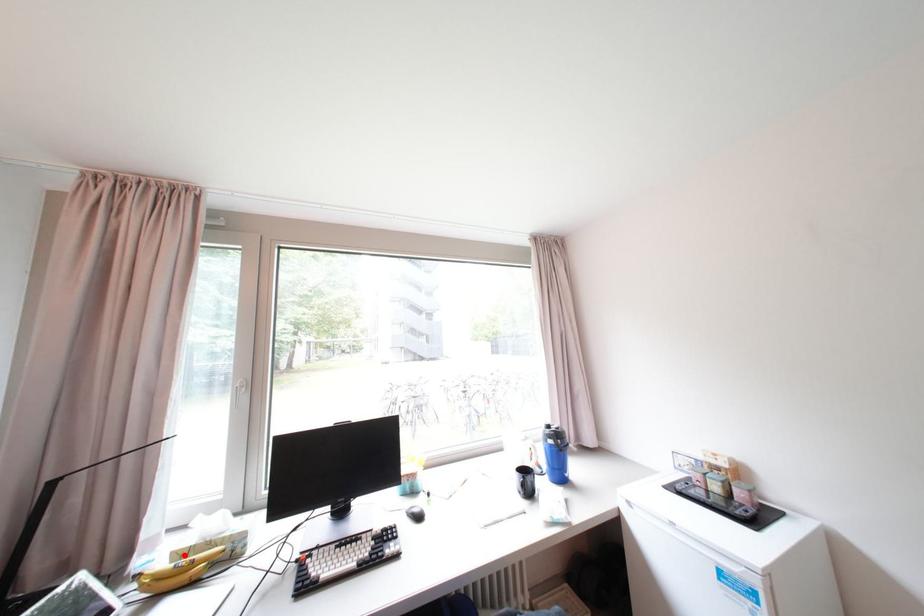
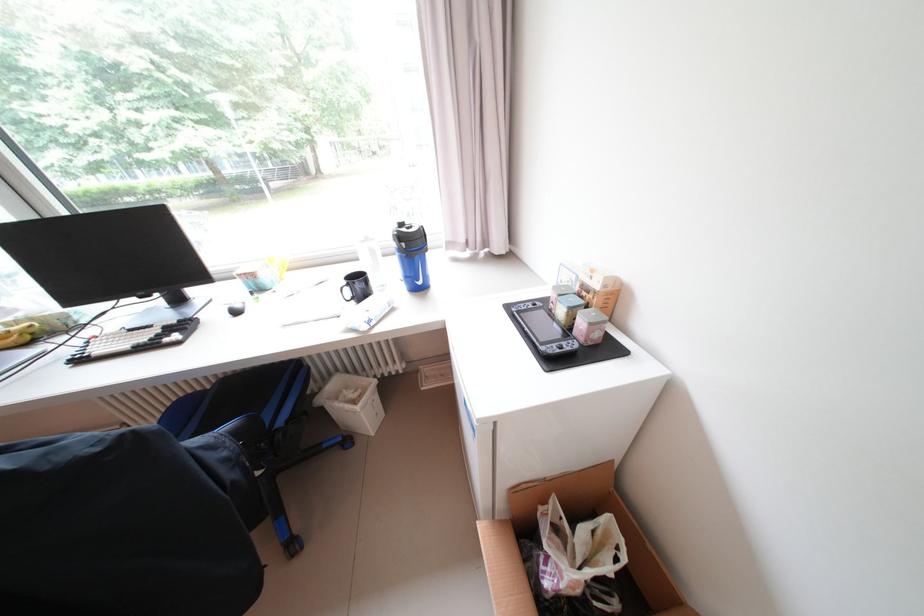
Find the pixel in the second image that matches the highlighted location in the first image.

(15, 326)